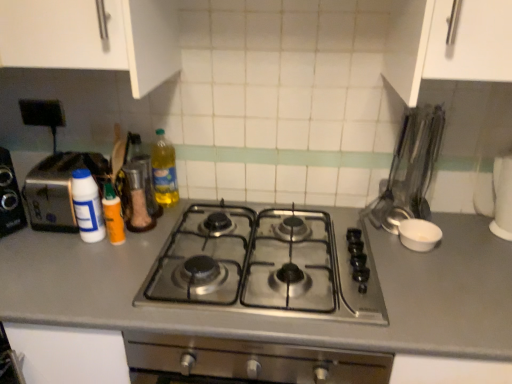
The image size is (512, 384). What do you see at coordinates (419, 234) in the screenshot?
I see `white matte bowl at right, which is the 2th appliance from top to bottom` at bounding box center [419, 234].

In order to click on silver metallic toaster at left in this screenshot , I will do `click(59, 189)`.

Image resolution: width=512 pixels, height=384 pixels. What do you see at coordinates (267, 264) in the screenshot?
I see `stainless steel gas stove at center` at bounding box center [267, 264].

What are the coordinates of `stainless steel gas stove at center` in the screenshot? It's located at (267, 264).

The width and height of the screenshot is (512, 384). Find the location of `translucent orange bottle at center left, which is counted as the second bottle, starting from the right`. translucent orange bottle at center left, which is counted as the second bottle, starting from the right is located at coordinates (113, 215).

I want to click on translucent plastic bottle at center, arranged as the first bottle when viewed from the right, so click(164, 170).

Considering the sizes of objects white plastic bottle at left, which is the 3th bottle from right to left, and translucent plastic bottle at center, arranged as the first bottle when viewed from the right, in the image provided, who is taller, white plastic bottle at left, which is the 3th bottle from right to left, or translucent plastic bottle at center, arranged as the first bottle when viewed from the right,?

With more height is translucent plastic bottle at center, arranged as the first bottle when viewed from the right.

Image resolution: width=512 pixels, height=384 pixels. I want to click on the 2nd bottle to the right of the white plastic bottle at left, which is the 3th bottle from right to left, counting from the anchor's position, so click(x=164, y=170).

Is translucent plastic bottle at center, the 3th bottle viewed from the left, at the back of white plastic bottle at left, which is the 3th bottle from right to left?

That's not correct — white plastic bottle at left, which is the 3th bottle from right to left, is not looking away from translucent plastic bottle at center, the 3th bottle viewed from the left.

Considering the sizes of objects metallic silver utensils at right, acting as the second appliance starting from the bottom, and translucent orange bottle at center left, which appears as the second bottle when viewed from the left, in the image provided, who is taller, metallic silver utensils at right, acting as the second appliance starting from the bottom, or translucent orange bottle at center left, which appears as the second bottle when viewed from the left,?

With more height is metallic silver utensils at right, acting as the second appliance starting from the bottom.

Is metallic silver utensils at right, acting as the second appliance starting from the bottom, oriented away from translucent orange bottle at center left, which is counted as the second bottle, starting from the right?

No, translucent orange bottle at center left, which is counted as the second bottle, starting from the right, is not at the back of metallic silver utensils at right, acting as the second appliance starting from the bottom.

Between metallic silver utensils at right, the first appliance positioned from the top, and translucent orange bottle at center left, which appears as the second bottle when viewed from the left, which one appears on the left side from the viewer's perspective?

translucent orange bottle at center left, which appears as the second bottle when viewed from the left.

Does translucent orange bottle at center left, which appears as the second bottle when viewed from the left, have a greater width compared to silver metallic toaster at left?

No, translucent orange bottle at center left, which appears as the second bottle when viewed from the left, is not wider than silver metallic toaster at left.

From a real-world perspective, which bottle is the 3rd one underneath the silver metallic toaster at left? Please provide its 2D coordinates.

[(113, 215)]

Is point (109, 193) closer to viewer compared to point (51, 180)?

Yes, point (109, 193) is closer to viewer.

Is stainless steel gas stove at center at the right side of translucent plastic bottle at center, the 3th bottle viewed from the left?

Correct, you'll find stainless steel gas stove at center to the right of translucent plastic bottle at center, the 3th bottle viewed from the left.

What's the angular difference between stainless steel gas stove at center and translucent plastic bottle at center, arranged as the first bottle when viewed from the right,'s facing directions?

They differ by 5.95 degrees in their facing directions.

Where is `gas stove below the translucent plastic bottle at center, arranged as the first bottle when viewed from the right (from a real-world perspective)`? This screenshot has height=384, width=512. gas stove below the translucent plastic bottle at center, arranged as the first bottle when viewed from the right (from a real-world perspective) is located at coordinates (267, 264).

Is stainless steel gas stove at center next to translucent plastic bottle at center, arranged as the first bottle when viewed from the right, and touching it?

No, stainless steel gas stove at center is not beside translucent plastic bottle at center, arranged as the first bottle when viewed from the right.

From the image's perspective, does white plastic bottle at left, placed as the first bottle when sorted from left to right, appear higher than silver metallic toaster at left?

Incorrect, from the image's perspective, white plastic bottle at left, placed as the first bottle when sorted from left to right, is lower than silver metallic toaster at left.

Is white plastic bottle at left, placed as the first bottle when sorted from left to right, aimed at silver metallic toaster at left?

No, white plastic bottle at left, placed as the first bottle when sorted from left to right, is not oriented towards silver metallic toaster at left.

From their relative heights in the image, would you say white plastic bottle at left, placed as the first bottle when sorted from left to right, is taller or shorter than silver metallic toaster at left?

white plastic bottle at left, placed as the first bottle when sorted from left to right, is shorter than silver metallic toaster at left.

The width and height of the screenshot is (512, 384). I want to click on toaster located on the left of white plastic bottle at left, placed as the first bottle when sorted from left to right, so click(x=59, y=189).

Between white matte bowl at right, which is the 2th appliance from top to bottom, and stainless steel gas stove at center, which one appears on the right side from the viewer's perspective?

Positioned to the right is white matte bowl at right, which is the 2th appliance from top to bottom.

From the image's perspective, is white matte bowl at right, the first appliance ordered from the bottom, above or below stainless steel gas stove at center?

Based on their image positions, white matte bowl at right, the first appliance ordered from the bottom, is located above stainless steel gas stove at center.

Is white matte bowl at right, which is the 2th appliance from top to bottom, wider or thinner than stainless steel gas stove at center?

Considering their sizes, white matte bowl at right, which is the 2th appliance from top to bottom, looks slimmer than stainless steel gas stove at center.

Is stainless steel gas stove at center bigger or smaller than translucent orange bottle at center left, which appears as the second bottle when viewed from the left?

In the image, stainless steel gas stove at center appears to be larger than translucent orange bottle at center left, which appears as the second bottle when viewed from the left.

Would you say stainless steel gas stove at center is a long distance from translucent orange bottle at center left, which is counted as the second bottle, starting from the right?

Actually, stainless steel gas stove at center and translucent orange bottle at center left, which is counted as the second bottle, starting from the right, are a little close together.

What's the angular difference between stainless steel gas stove at center and translucent orange bottle at center left, which is counted as the second bottle, starting from the right,'s facing directions?

1.21 degrees separate the facing orientations of stainless steel gas stove at center and translucent orange bottle at center left, which is counted as the second bottle, starting from the right.

Considering the positions of points (375, 309) and (106, 202), is point (375, 309) farther from camera compared to point (106, 202)?

That is False.

Find the location of `the 2nd bottle counting from the right of the white plastic bottle at left, which is the 3th bottle from right to left`. the 2nd bottle counting from the right of the white plastic bottle at left, which is the 3th bottle from right to left is located at coordinates (164, 170).

I want to click on appliance above the translucent orange bottle at center left, which is counted as the second bottle, starting from the right (from the image's perspective), so click(410, 170).

Looking at the image, which one is located closer to stainless steel gas stove at center, metallic silver utensils at right, the first appliance positioned from the top, or silver metallic toaster at left?

metallic silver utensils at right, the first appliance positioned from the top.

Based on the photo, looking at the image, which one is located closer to silver metallic toaster at left, white matte bowl at right, which is the 2th appliance from top to bottom, or translucent plastic bottle at center, arranged as the first bottle when viewed from the right?

Result: translucent plastic bottle at center, arranged as the first bottle when viewed from the right, lies closer to silver metallic toaster at left than the other object.

Estimate the real-world distances between objects in this image. Which object is further from translucent orange bottle at center left, which is counted as the second bottle, starting from the right, white plastic bottle at left, placed as the first bottle when sorted from left to right, or silver metallic toaster at left?

silver metallic toaster at left is positioned further to the anchor translucent orange bottle at center left, which is counted as the second bottle, starting from the right.

Based on their spatial positions, is translucent orange bottle at center left, which appears as the second bottle when viewed from the left, or white plastic bottle at left, which is the 3th bottle from right to left, further from stainless steel gas stove at center?

white plastic bottle at left, which is the 3th bottle from right to left, is positioned further to the anchor stainless steel gas stove at center.

Based on their spatial positions, is white plastic bottle at left, which is the 3th bottle from right to left, or translucent plastic bottle at center, arranged as the first bottle when viewed from the right, closer to stainless steel gas stove at center?

Based on the image, white plastic bottle at left, which is the 3th bottle from right to left, appears to be nearer to stainless steel gas stove at center.

Which object lies nearer to the anchor point translucent orange bottle at center left, which appears as the second bottle when viewed from the left, white plastic bottle at left, which is the 3th bottle from right to left, or translucent plastic bottle at center, arranged as the first bottle when viewed from the right?

Among the two, white plastic bottle at left, which is the 3th bottle from right to left, is located nearer to translucent orange bottle at center left, which appears as the second bottle when viewed from the left.

Looking at the image, which one is located further to white matte bowl at right, which is the 2th appliance from top to bottom, silver metallic toaster at left or metallic silver utensils at right, the first appliance positioned from the top?

silver metallic toaster at left is positioned further to the anchor white matte bowl at right, which is the 2th appliance from top to bottom.

Considering their positions, is white matte bowl at right, the first appliance ordered from the bottom, positioned closer to translucent plastic bottle at center, arranged as the first bottle when viewed from the right, than white plastic bottle at left, placed as the first bottle when sorted from left to right?

white plastic bottle at left, placed as the first bottle when sorted from left to right, is positioned closer to the anchor translucent plastic bottle at center, arranged as the first bottle when viewed from the right.

Identify the location of appliance situated between silver metallic toaster at left and white matte bowl at right, the first appliance ordered from the bottom, from left to right. The height and width of the screenshot is (384, 512). (410, 170).

You are a GUI agent. You are given a task and a screenshot of the screen. Output one action in this format:
    pyautogui.click(x=<x>, y=<y>)
    Task: Click on the gas stove between silver metallic toaster at left and white matte bowl at right, the first appliance ordered from the bottom, in the horizontal direction
    
    Given the screenshot: What is the action you would take?
    (267, 264)

Locate an element on the screen. This screenshot has height=384, width=512. appliance between translucent plastic bottle at center, arranged as the first bottle when viewed from the right, and white matte bowl at right, the first appliance ordered from the bottom is located at coordinates (410, 170).

Find the location of a particular element. The width and height of the screenshot is (512, 384). gas stove situated between translucent plastic bottle at center, arranged as the first bottle when viewed from the right, and metallic silver utensils at right, acting as the second appliance starting from the bottom, from left to right is located at coordinates (267, 264).